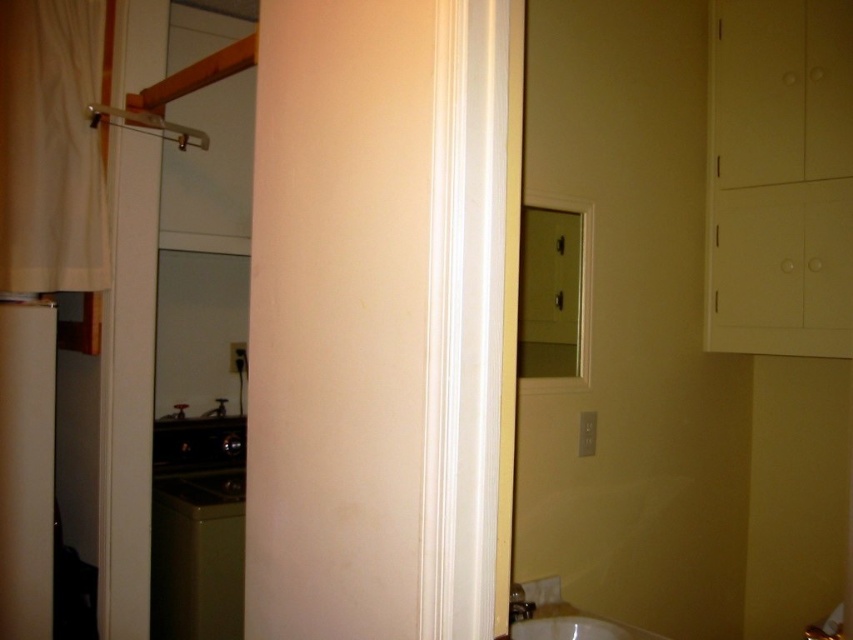
Does white fabric curtain at left appear on the right side of white glossy sink at lower center?

No, white fabric curtain at left is not to the right of white glossy sink at lower center.

Is white fabric curtain at left to the left of white glossy sink at lower center from the viewer's perspective?

Correct, you'll find white fabric curtain at left to the left of white glossy sink at lower center.

Does point (15, 232) come farther from viewer compared to point (543, 609)?

No.

Find the location of `white fabric curtain at left`. white fabric curtain at left is located at coordinates (51, 147).

Does white glossy sink at lower center have a lesser width compared to clear plastic shower at upper left?

No.

Can you confirm if white glossy sink at lower center is positioned to the left of clear plastic shower at upper left?

No, white glossy sink at lower center is not to the left of clear plastic shower at upper left.

Is point (537, 621) positioned before point (178, 147)?

Yes.

Identify the location of white glossy sink at lower center. The width and height of the screenshot is (853, 640). (561, 616).

Can you confirm if white fabric curtain at left is positioned below clear plastic shower at upper left?

Correct, white fabric curtain at left is located below clear plastic shower at upper left.

From the picture: Does white fabric curtain at left come behind clear plastic shower at upper left?

No, it is in front of clear plastic shower at upper left.

At what (x,y) coordinates should I click in order to perform the action: click on white fabric curtain at left. Please return your answer as a coordinate pair (x, y). Looking at the image, I should click on (51, 147).